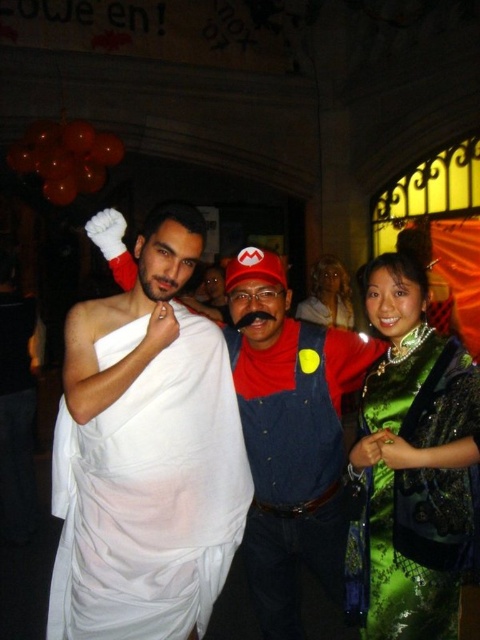
You are standing at the camera position and want to know how far the point at coordinates (63,509) is from you. Can you determine the distance?

The point at coordinates (63,509) is 6.53 meters away from the camera position.

You are organizing a costume party and need to hang the white cloth at center and green satin dress at right on a rack. If the rack has a maximum width capacity of 1.2 meters, can both items be placed side by side without exceeding the rack?

The white cloth at center might be wider than green satin dress at right, so there is uncertainty about whether their combined width would exceed the rack capacity. It is safer to check the exact measurements before placing them side by side.